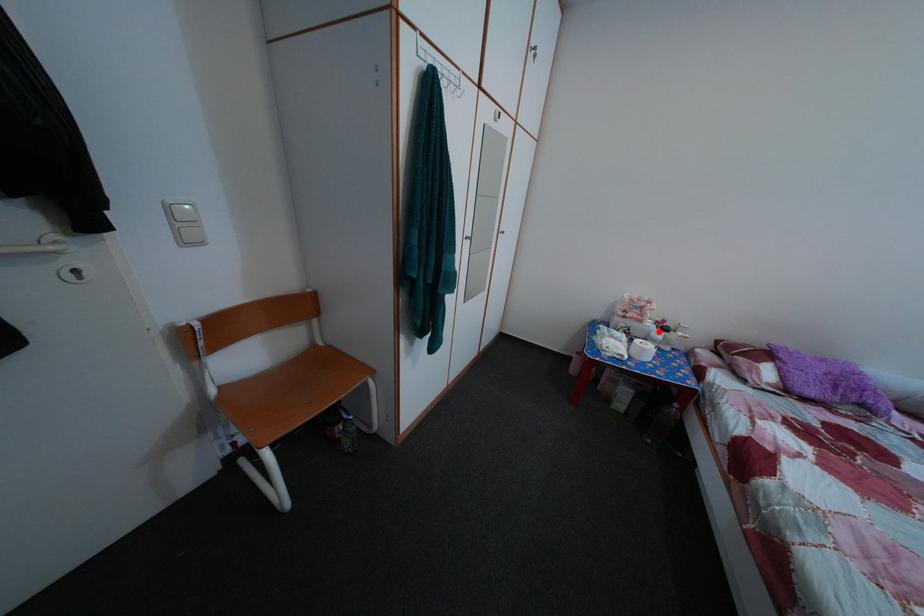
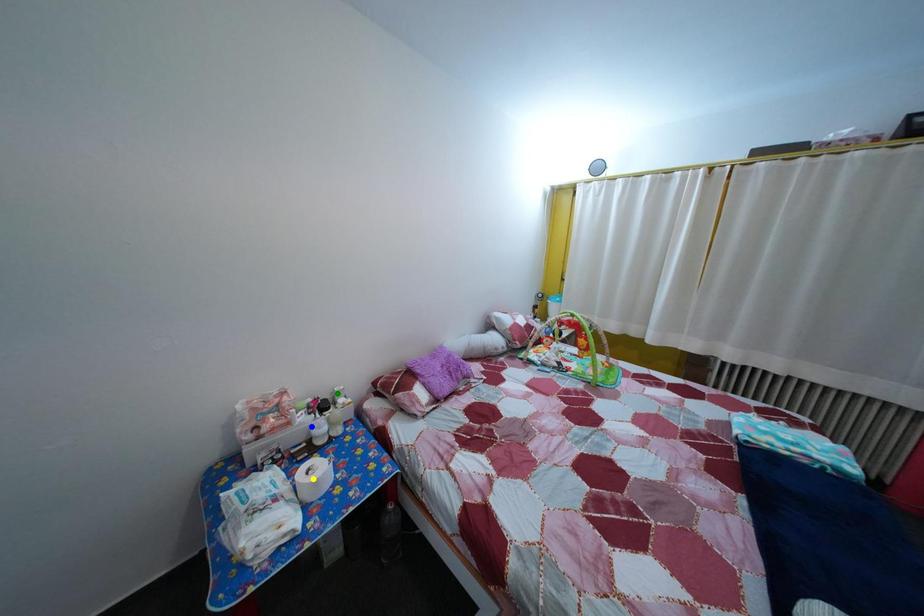
Question: I am providing you with two images of the same scene from different viewpoints. A red point is marked on the first image. You are given multiple points on the second image. Which point in image 2 is actually the same real-world point as the red point in image 1?

Choices:
 (A) blue point
 (B) yellow point
 (C) green point

Answer: (A)